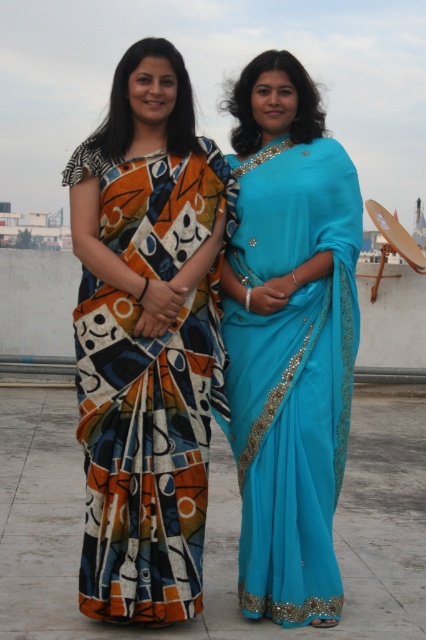
Who is lower down, turquoise satin saree at center or abstract print fabric sari at left?

abstract print fabric sari at left

Is turquoise satin saree at center positioned behind abstract print fabric sari at left?

Yes, it is.

Is point (298, 625) positioned behind point (146, 531)?

Yes, point (298, 625) is behind point (146, 531).

Locate an element on the screen. The width and height of the screenshot is (426, 640). turquoise satin saree at center is located at coordinates (288, 339).